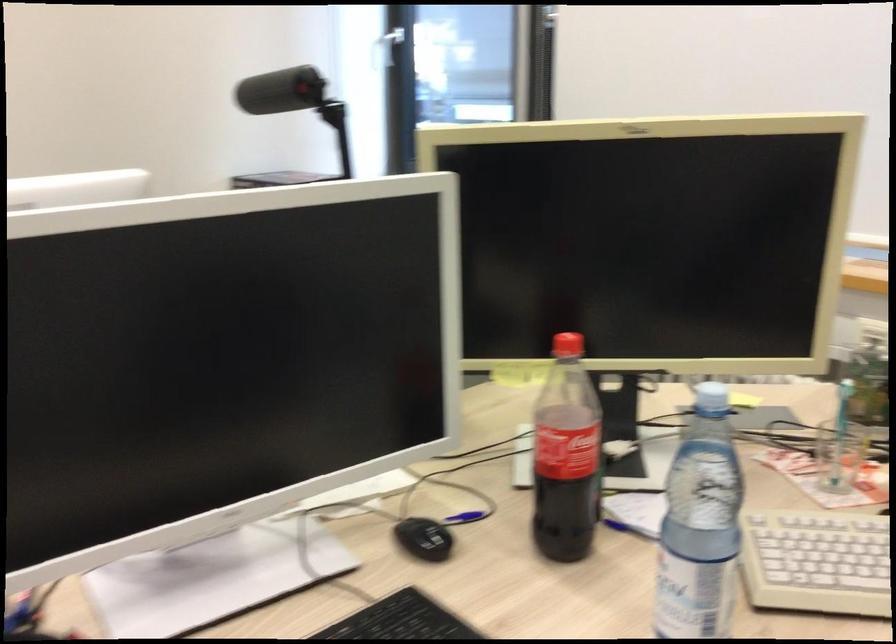
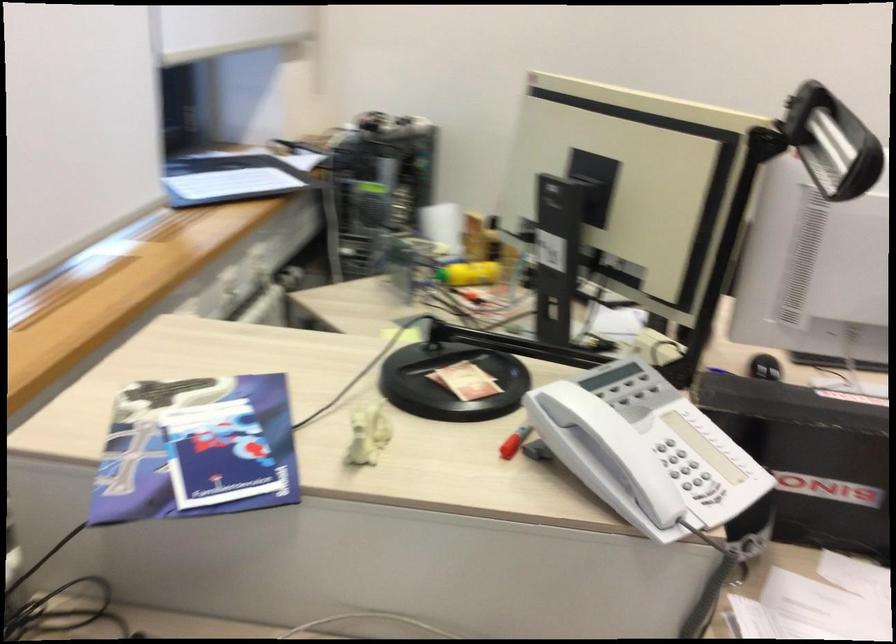
Question: I am providing you with two images of the same scene from different viewpoints. Please identify which objects are invisible in image2.

Choices:
 (A) clear paper tray
 (B) red marker
 (C) red bottle cap
 (D) purple brochure

Answer: (C)